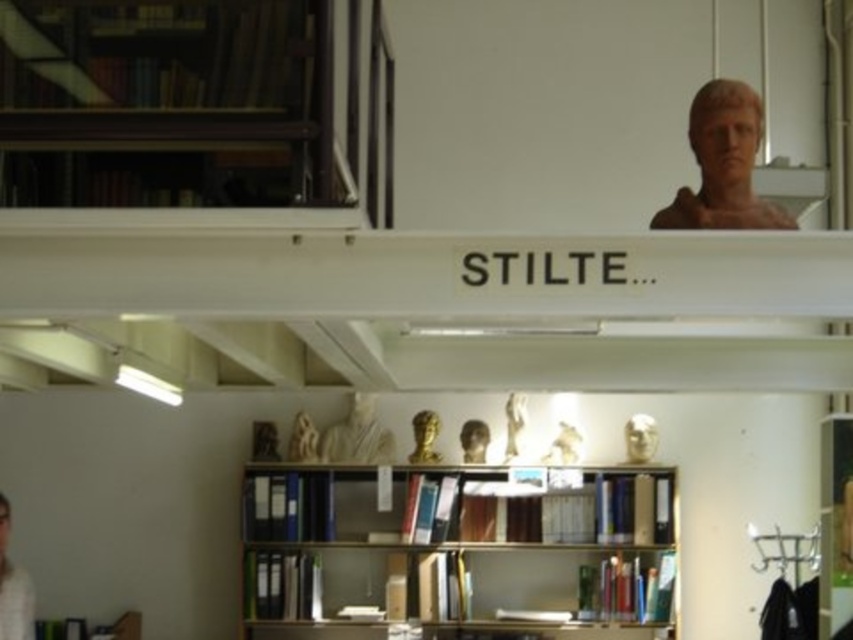
Based on the scene description, where is the matte brown bust at upper right located in the image?

The matte brown bust at upper right is located at point (723, 164).

You are standing in the library scene and want to take a photo of the matte gold bust at center without the white matte person at lower left blocking it. How should you adjust your position?

The white matte person at lower left is in front of the matte gold bust at center. To avoid blocking the view, move to the side so that the white matte person at lower left is no longer between you and the matte gold bust at center.

You are a librarian organizing the library. You need to place a new book on the shelf. The shelf has limited height. Which of the two busts, the matte brown bust at upper right or the matte gold bust at center, would you have to move to make space for the taller book?

The matte brown bust at upper right is much taller than the matte gold bust at center, so you would need to move the matte brown bust at upper right to make space for the taller book.